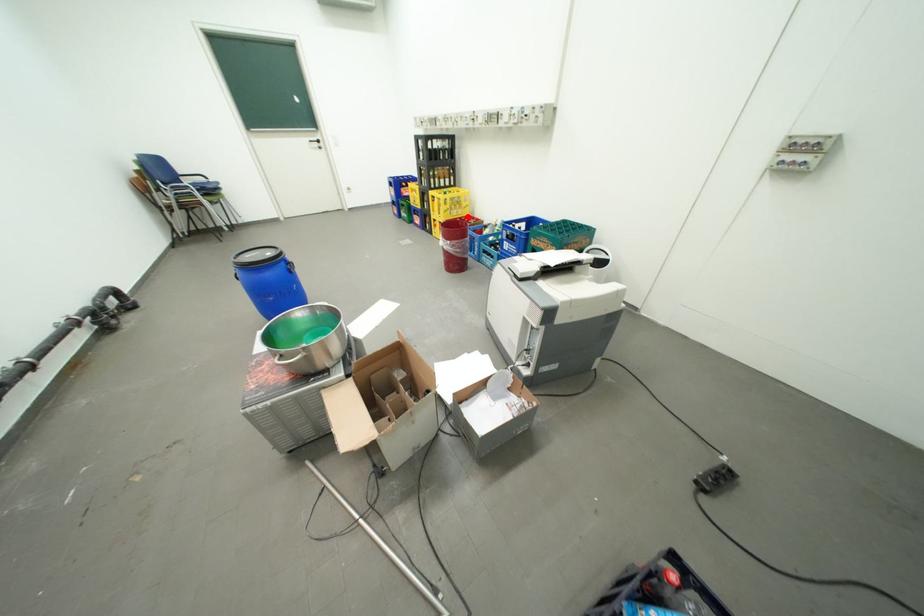
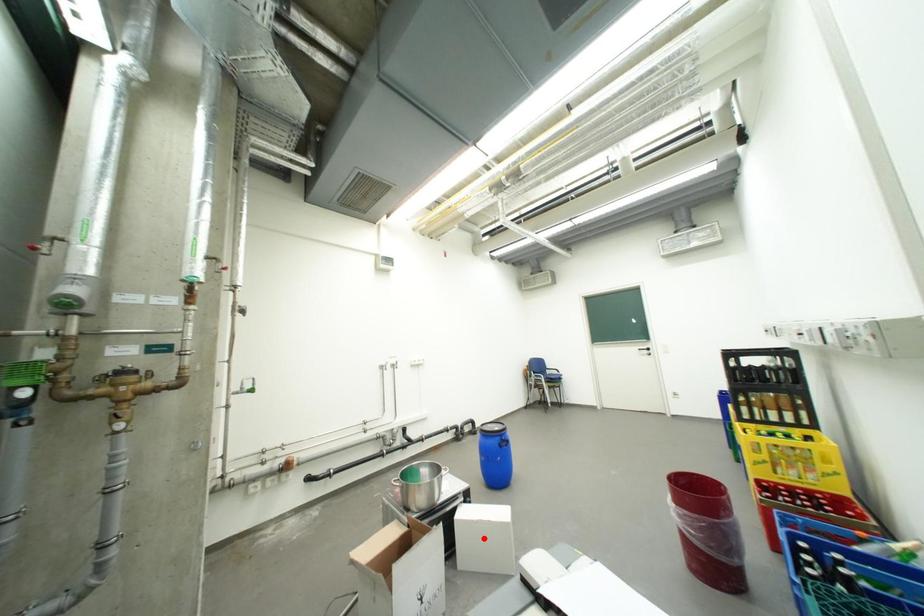
I am providing you with two images of the same scene from different viewpoints. A red point is marked on the first image and another point is marked on the second image. Do the highlighted points in image1 and image2 indicate the same real-world spot?

No